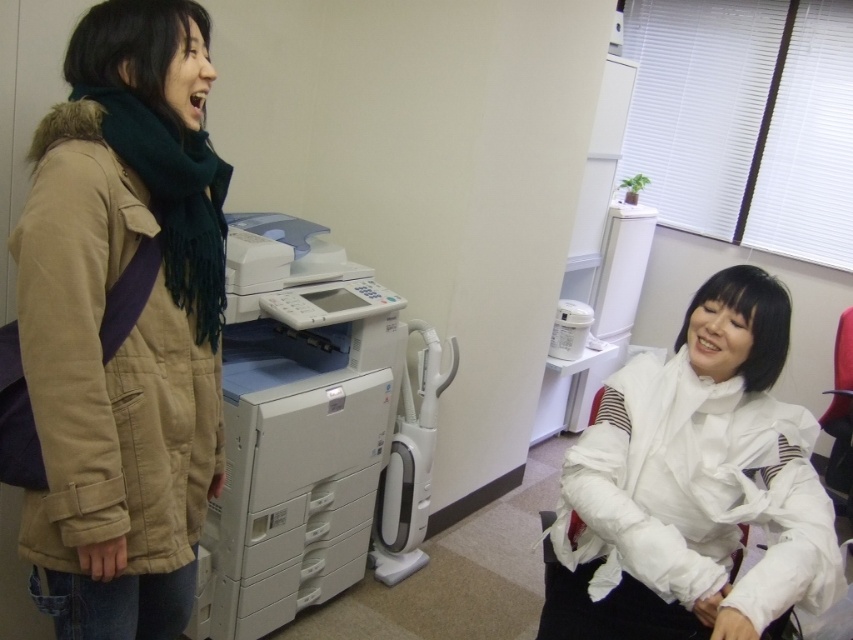
Question: Which is nearer to the matte brown jacket at left?

Choices:
 (A) white fabric at center
 (B) white matte printer at left

Answer: (B)

Question: Which point is farther to the camera?

Choices:
 (A) (329, 260)
 (B) (186, 84)

Answer: (A)

Question: Is matte brown jacket at left positioned before white matte printer at left?

Choices:
 (A) yes
 (B) no

Answer: (A)

Question: Is matte brown jacket at left to the left of white matte printer at left from the viewer's perspective?

Choices:
 (A) no
 (B) yes

Answer: (B)

Question: Which point is farther to the camera?

Choices:
 (A) (393, 486)
 (B) (119, 257)

Answer: (A)

Question: Does white fabric at center have a smaller size compared to white plastic vacuum cleaner at center?

Choices:
 (A) yes
 (B) no

Answer: (B)